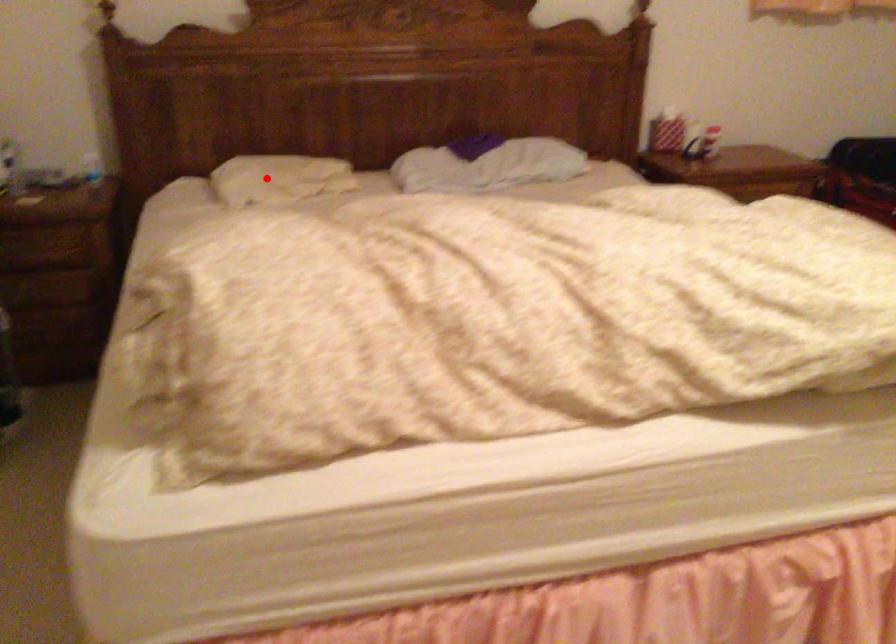
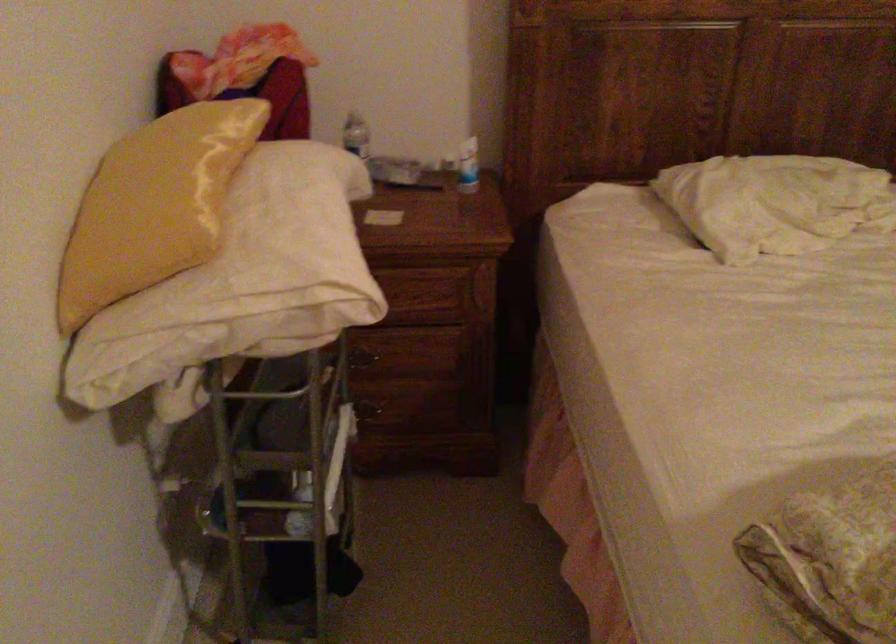
Question: I am providing you with two images of the same scene from different viewpoints. Given a red point in image1, look at the same physical point in image2. Is it:

Choices:
 (A) Closer to the viewpoint
 (B) Farther from the viewpoint

Answer: (A)